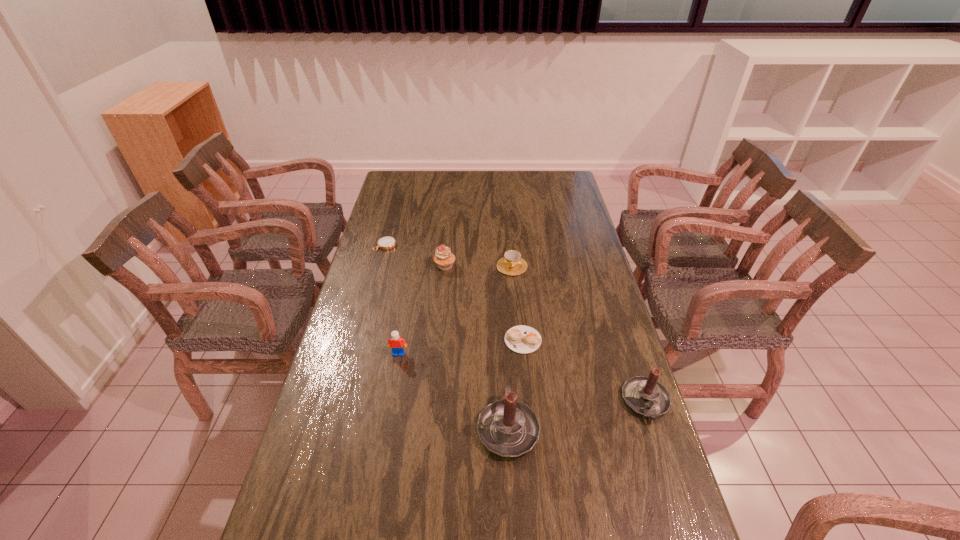
Please point a spot on the left to add another candle. Please provide its 2D coordinates. Your answer should be formatted as a tuple, i.e. [(x, y)], where the tuple contains the x and y coordinates of a point satisfying the conditions above.

[(356, 456)]